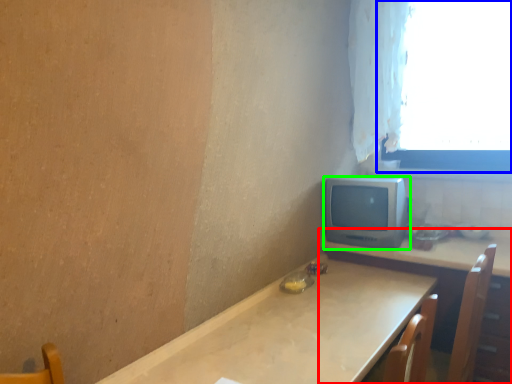
Question: Estimate the real-world distances between objects in this image. Which object is farther from table (highlighted by a red box), window (highlighted by a blue box) or computer monitor (highlighted by a green box)?

Choices:
 (A) window
 (B) computer monitor

Answer: (A)